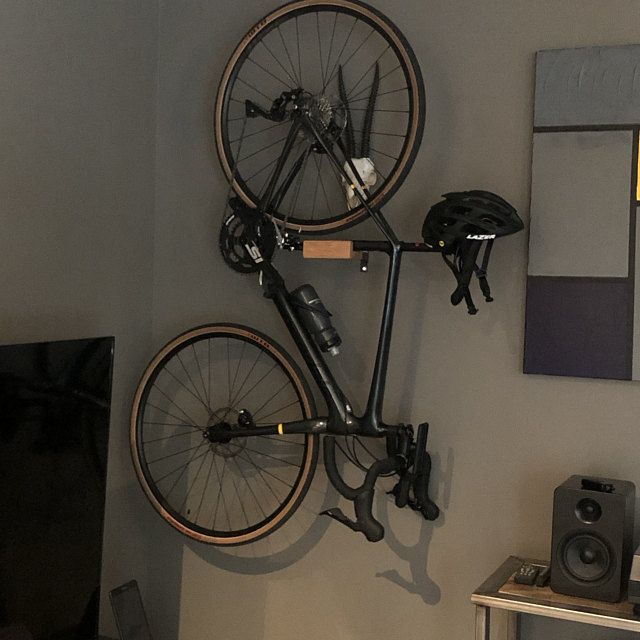
Locate an element on the screen. The image size is (640, 640). table is located at coordinates (493, 594).